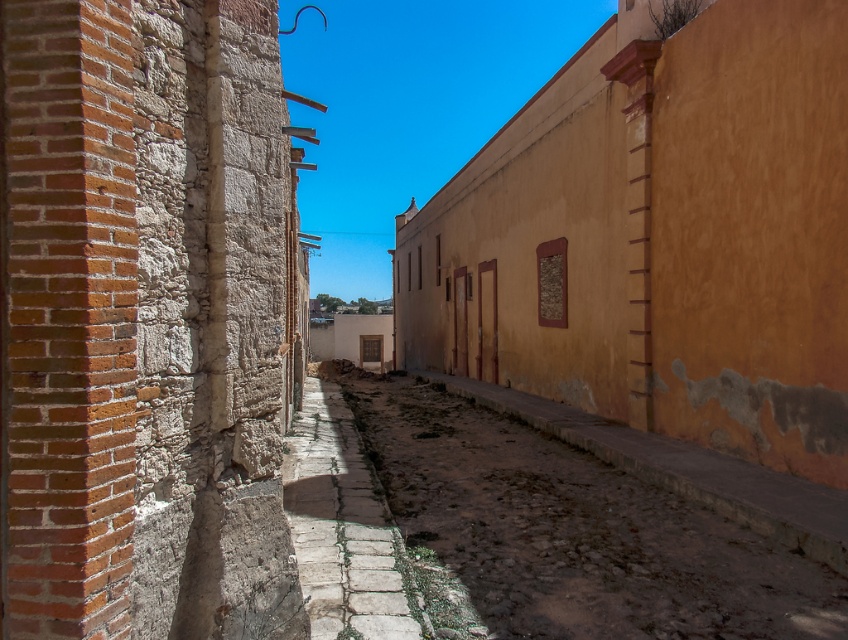
Question: Among these points, which one is farthest from the camera?

Choices:
 (A) (363, 548)
 (B) (556, 630)

Answer: (A)

Question: Which point is closer to the camera?

Choices:
 (A) (x=316, y=454)
 (B) (x=729, y=531)

Answer: (B)

Question: Can you confirm if dirt cobblestone path at center is bigger than stone paved path at center?

Choices:
 (A) no
 (B) yes

Answer: (A)

Question: Does dirt cobblestone path at center appear under stone paved path at center?

Choices:
 (A) no
 (B) yes

Answer: (B)

Question: Is dirt cobblestone path at center bigger than stone paved path at center?

Choices:
 (A) yes
 (B) no

Answer: (B)